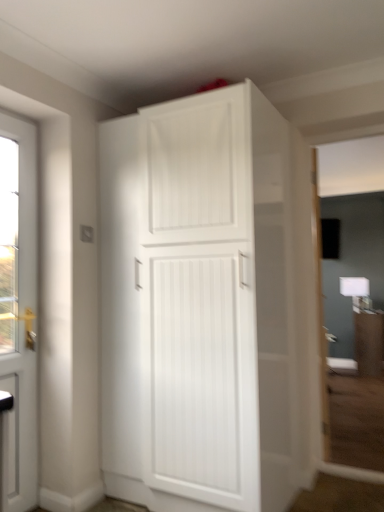
Describe the element at coordinates (206, 305) in the screenshot. I see `white matte cabinet at upper center` at that location.

Image resolution: width=384 pixels, height=512 pixels. I want to click on matte white cabinet at center, so click(369, 341).

From a real-world perspective, is white matte cabinet at upper center located higher than matte white cabinet at center?

Indeed, from a real-world perspective, white matte cabinet at upper center stands above matte white cabinet at center.

Is white matte cabinet at upper center far away from matte white cabinet at center?

Yes.

Is white matte cabinet at upper center facing towards matte white cabinet at center?

No, white matte cabinet at upper center is not oriented towards matte white cabinet at center.

Consider the image. Is white matte cabinet at upper center positioned behind matte white cabinet at center?

No, white matte cabinet at upper center is closer to the viewer.

Is white glossy door at left smaller than matte white cabinet at center?

Indeed, white glossy door at left has a smaller size compared to matte white cabinet at center.

Is white glossy door at left far away from matte white cabinet at center?

white glossy door at left is far away from matte white cabinet at center.

Between point (32, 463) and point (373, 320), which one is positioned in front?

Positioned in front is point (32, 463).

Which is correct: white glossy door at left is inside white matte cabinet at upper center, or outside of it?

white glossy door at left is outside white matte cabinet at upper center.

From a real-world perspective, is white glossy door at left beneath white matte cabinet at upper center?

Yes, from a real-world perspective, white glossy door at left is beneath white matte cabinet at upper center.

Which is closer, (0, 134) or (189, 348)?

Point (0, 134).

Who is bigger, white glossy door at left or white matte cabinet at upper center?

With larger size is white matte cabinet at upper center.

What's the angular difference between white matte cabinet at upper center and white glossy door at left's facing directions?

The angle between the facing direction of white matte cabinet at upper center and the facing direction of white glossy door at left is 91.8 degrees.

Is white matte cabinet at upper center aimed at white glossy door at left?

No, white matte cabinet at upper center is not oriented towards white glossy door at left.

From a real-world perspective, between white matte cabinet at upper center and white glossy door at left, who is vertically lower?

white glossy door at left.

From the image's perspective, is white matte cabinet at upper center above white glossy door at left?

Correct, white matte cabinet at upper center appears higher than white glossy door at left in the image.

From the image's perspective, relative to white glossy door at left, is matte white cabinet at center above or below?

Clearly, from the image's perspective, matte white cabinet at center is below white glossy door at left.

Which object is closer to the camera, matte white cabinet at center or white glossy door at left?

white glossy door at left is more forward.

Is matte white cabinet at center positioned with its back to white glossy door at left?

No, matte white cabinet at center is not facing the opposite direction of white glossy door at left.

Is matte white cabinet at center positioned far away from white matte cabinet at upper center?

That's right, there is a large distance between matte white cabinet at center and white matte cabinet at upper center.

Could you tell me if matte white cabinet at center is facing white matte cabinet at upper center?

Yes, matte white cabinet at center is facing white matte cabinet at upper center.

Does matte white cabinet at center have a lesser width compared to white matte cabinet at upper center?

Correct, the width of matte white cabinet at center is less than that of white matte cabinet at upper center.

I want to click on cupboard located above the matte white cabinet at center (from the image's perspective), so click(x=206, y=305).

You are a GUI agent. You are given a task and a screenshot of the screen. Output one action in this format:
    pyautogui.click(x=<x>, y=<y>)
    Task: Click on the cupboard in front of the matte white cabinet at center
    The image size is (384, 512).
    Given the screenshot: What is the action you would take?
    pyautogui.click(x=206, y=305)

Find the location of a particular element. The height and width of the screenshot is (512, 384). door lying above the matte white cabinet at center (from the image's perspective) is located at coordinates (18, 311).

Which object lies nearer to the anchor point white matte cabinet at upper center, matte white cabinet at center or white glossy door at left?

white glossy door at left is closer to white matte cabinet at upper center.

Considering their positions, is matte white cabinet at center positioned closer to white glossy door at left than white matte cabinet at upper center?

Among the two, white matte cabinet at upper center is located nearer to white glossy door at left.

Considering their positions, is white glossy door at left positioned further to white matte cabinet at upper center than matte white cabinet at center?

Among the two, matte white cabinet at center is located further to white matte cabinet at upper center.

Considering their positions, is white matte cabinet at upper center positioned further to white glossy door at left than matte white cabinet at center?

Based on the image, matte white cabinet at center appears to be further to white glossy door at left.

Looking at the image, which one is located further to matte white cabinet at center, white matte cabinet at upper center or white glossy door at left?

Based on the image, white glossy door at left appears to be further to matte white cabinet at center.

From the image, which object appears to be farther from matte white cabinet at center, white glossy door at left or white matte cabinet at upper center?

white glossy door at left lies further to matte white cabinet at center than the other object.

Where is `door positioned between white matte cabinet at upper center and matte white cabinet at center from near to far`? The height and width of the screenshot is (512, 384). door positioned between white matte cabinet at upper center and matte white cabinet at center from near to far is located at coordinates (18, 311).